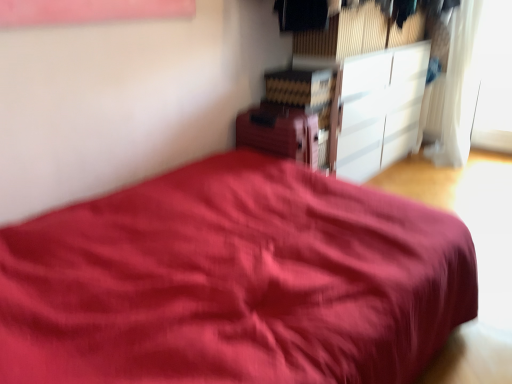
Question: Considering the positions of white sheer curtain at upper right and transparent glass window at upper right in the image, is white sheer curtain at upper right taller or shorter than transparent glass window at upper right?

Choices:
 (A) tall
 (B) short

Answer: (A)

Question: From a real-world perspective, relative to transparent glass window at upper right, is white sheer curtain at upper right vertically above or below?

Choices:
 (A) below
 (B) above

Answer: (A)

Question: Considering the real-world distances, which object is farthest from the transparent glass window at upper right?

Choices:
 (A) white sheer curtain at upper right
 (B) matte wooden cabinet at upper center, placed as the 2th cabinetry when sorted from right to left
 (C) white glossy cabinet at upper right, placed as the 1th cabinetry when sorted from right to left

Answer: (B)

Question: Which object is positioned closest to the white glossy cabinet at upper right, the 2th cabinetry in the left-to-right sequence?

Choices:
 (A) white sheer curtain at upper right
 (B) transparent glass window at upper right
 (C) matte wooden cabinet at upper center, positioned as the first cabinetry in front-to-back order

Answer: (A)